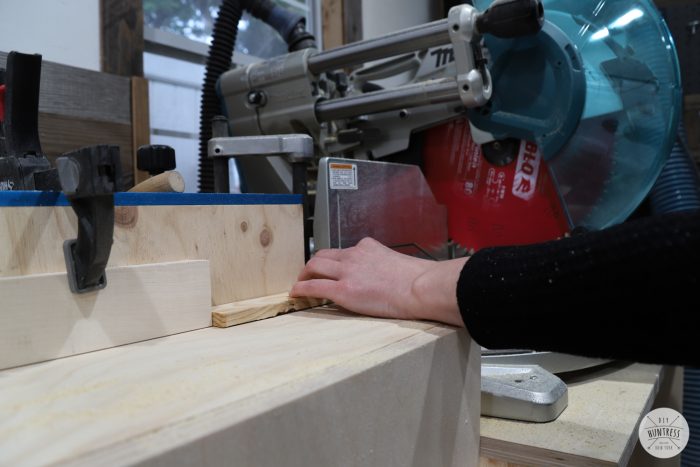
In order to click on off white wall in this screenshot , I will do `click(40, 19)`, `click(400, 17)`.